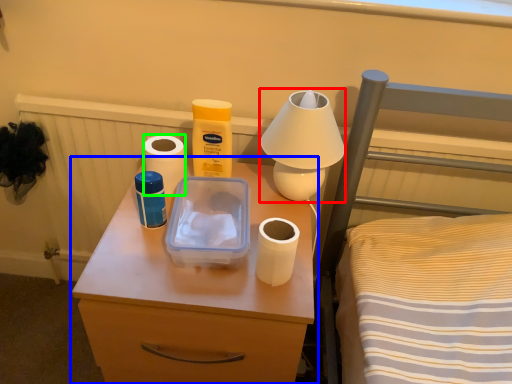
Question: Which is farther away from table lamp (highlighted by a red box)? nightstand (highlighted by a blue box) or toilet paper (highlighted by a green box)?

Choices:
 (A) nightstand
 (B) toilet paper

Answer: (A)